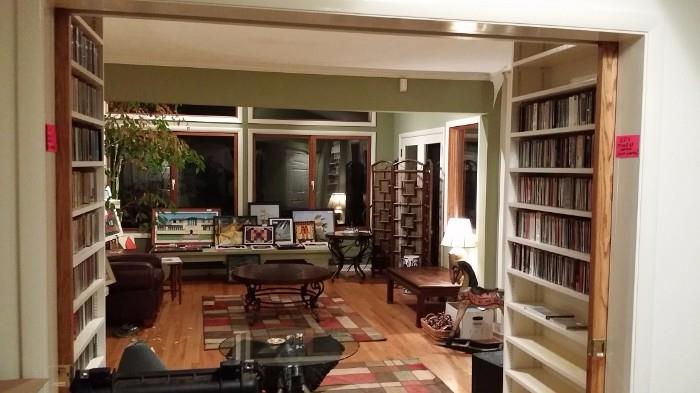
What are the coordinates of `leather seat` in the screenshot? It's located at (133, 288).